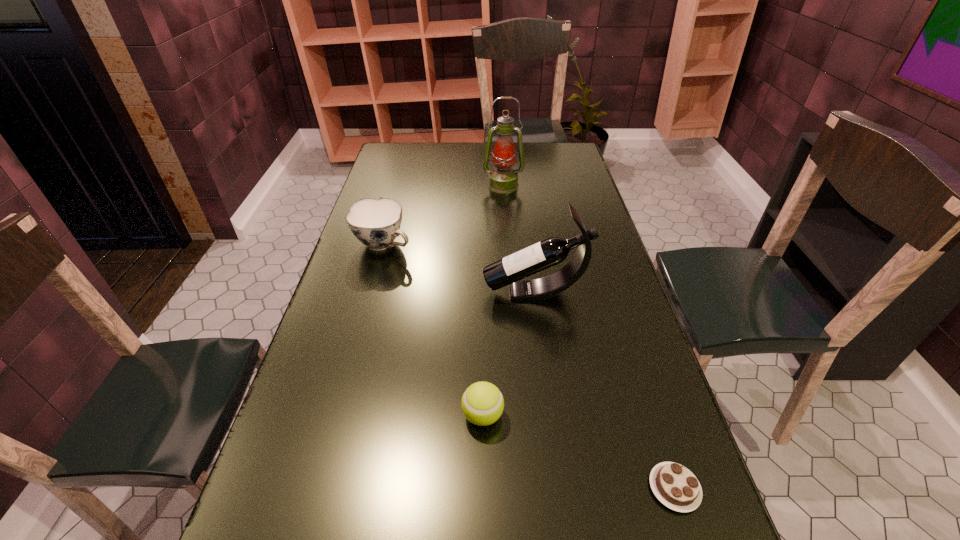
Locate which object is the fourth closest to the third tallest object. Please provide its 2D coordinates. Your answer should be formatted as a tuple, i.e. [(x, y)], where the tuple contains the x and y coordinates of a point satisfying the conditions above.

[(675, 486)]

Locate which object is the third closest to the oil lamp. Please provide its 2D coordinates. Your answer should be formatted as a tuple, i.e. [(x, y)], where the tuple contains the x and y coordinates of a point satisfying the conditions above.

[(482, 403)]

You are a GUI agent. You are given a task and a screenshot of the screen. Output one action in this format:
    pyautogui.click(x=<x>, y=<y>)
    Task: Click on the free space that satisfies the following two spatial constraints: 1. on the stand of the chocolate cake; 2. on the right side of the third nearest object
    The image size is (960, 540).
    Given the screenshot: What is the action you would take?
    pyautogui.click(x=562, y=488)